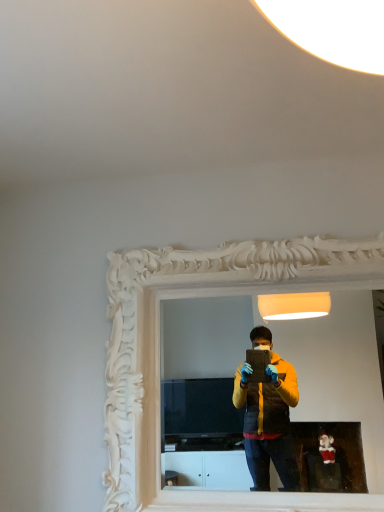
What do you see at coordinates (159, 349) in the screenshot? This screenshot has width=384, height=512. I see `white carved mirror at center` at bounding box center [159, 349].

Where is `white carved mirror at center`? white carved mirror at center is located at coordinates (159, 349).

The height and width of the screenshot is (512, 384). I want to click on white carved mirror at center, so click(x=159, y=349).